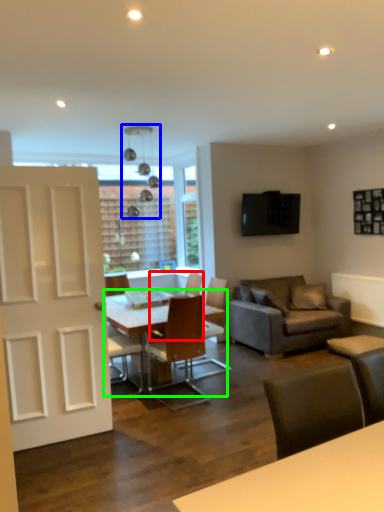
Question: Considering the real-world distances, which object is farthest from chair (highlighted by a red box)? light fixture (highlighted by a blue box) or table (highlighted by a green box)?

Choices:
 (A) light fixture
 (B) table

Answer: (A)